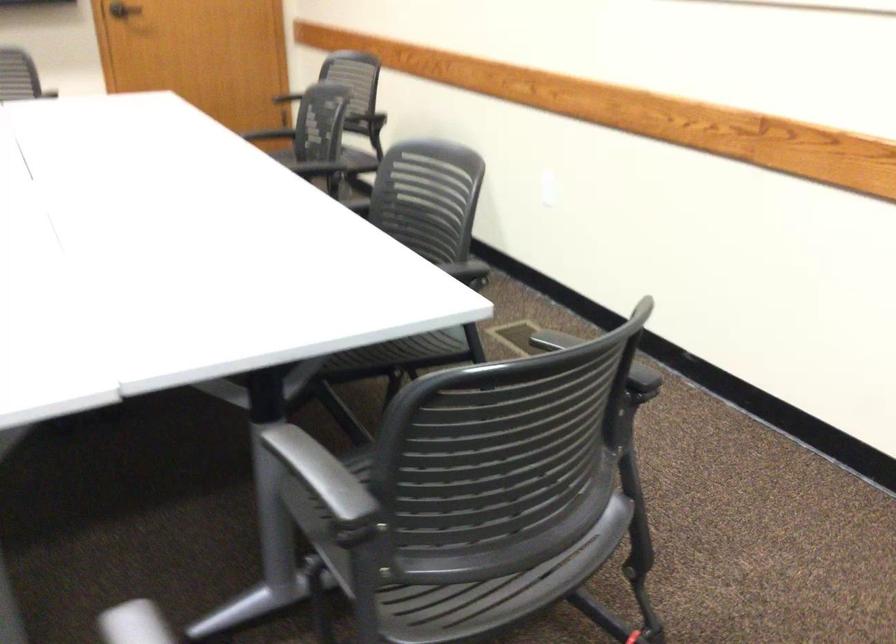
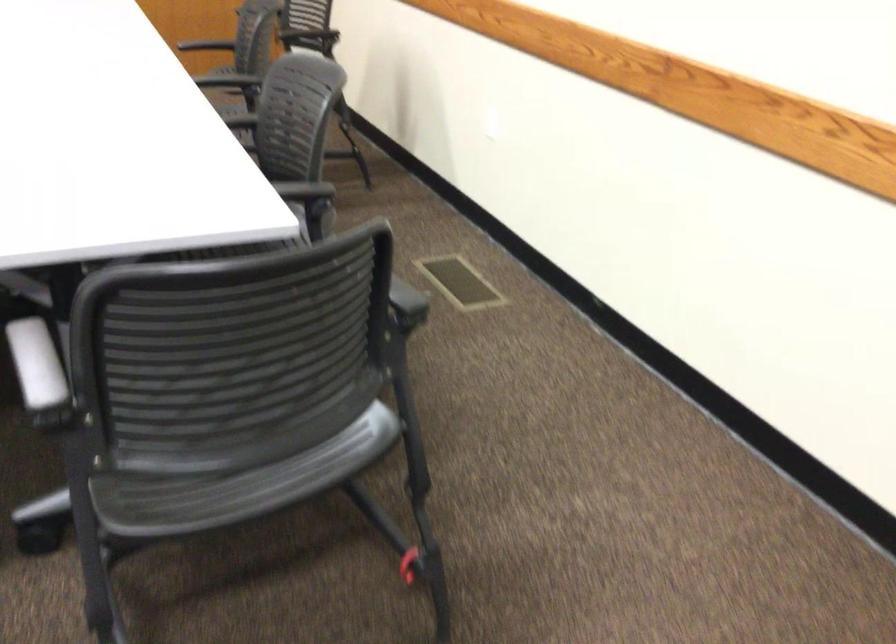
Question: The images are taken continuously from a first-person perspective. In which direction is your viewpoint rotating?

Choices:
 (A) Left
 (B) Right
 (C) Up
 (D) Down

Answer: (D)